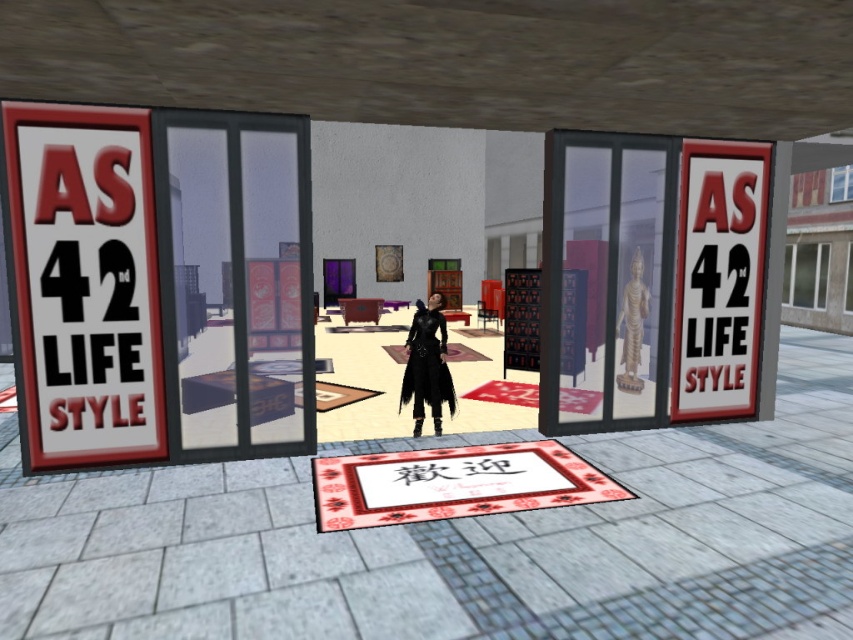
Question: Can you confirm if transparent glass statue at center is positioned to the right of red plastic sign at right?

Choices:
 (A) no
 (B) yes

Answer: (B)

Question: Where is red plastic sign at right located in relation to matte black coat at center in the image?

Choices:
 (A) right
 (B) left

Answer: (A)

Question: Which object is the closest to the matte black coat at center?

Choices:
 (A) red plastic sign at right
 (B) white paper sign at left

Answer: (A)

Question: Based on their relative distances, which object is nearer to the red plastic sign at right?

Choices:
 (A) white paper sign at left
 (B) transparent glass door at center

Answer: (A)

Question: Which of the following is the farthest from the observer?

Choices:
 (A) (430, 384)
 (B) (49, 141)

Answer: (A)

Question: Considering the relative positions of transparent glass statue at center and red plastic sign at right in the image provided, where is transparent glass statue at center located with respect to red plastic sign at right?

Choices:
 (A) right
 (B) left

Answer: (A)